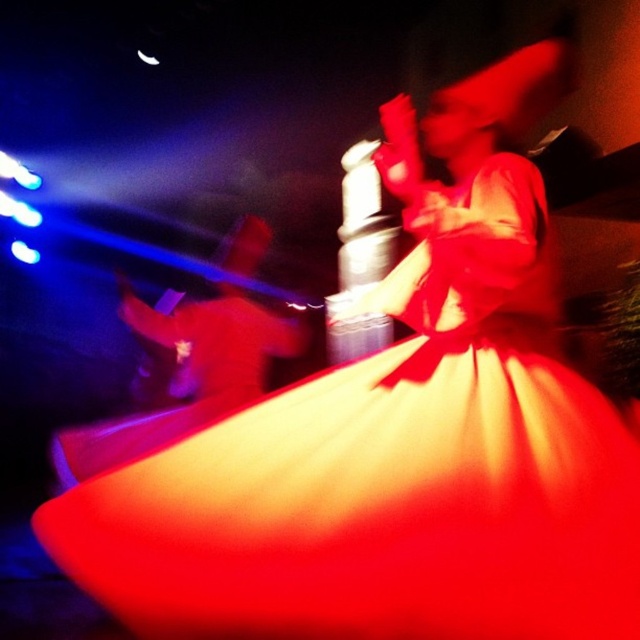
You are a photographer trying to capture the perfect shot of the shiny red fabric dress at center. Based on its position coordinates, where should you aim your camera to ensure the dress is centered in the frame?

The shiny red fabric dress at center is located at coordinates point (394,467), so you should aim your camera at that point to center it in the frame.